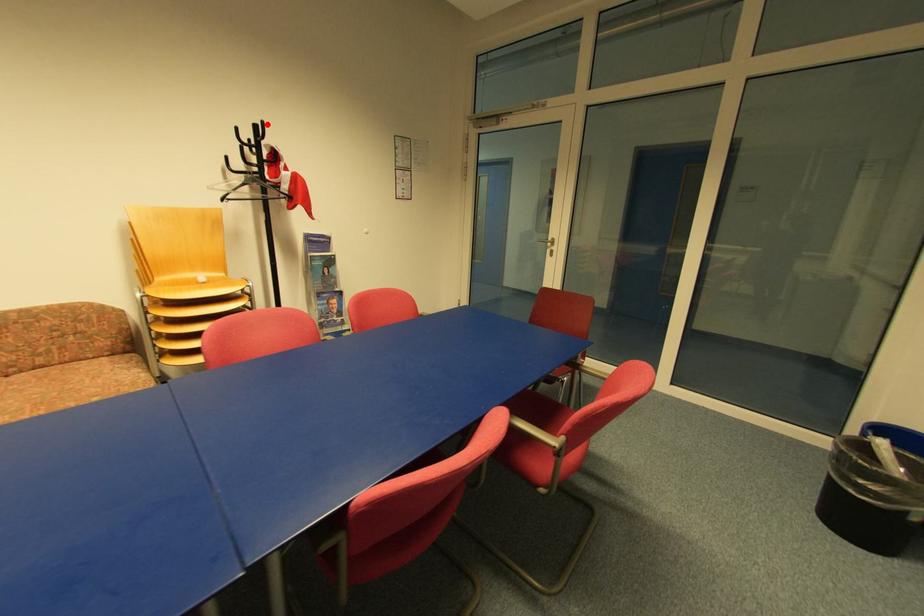
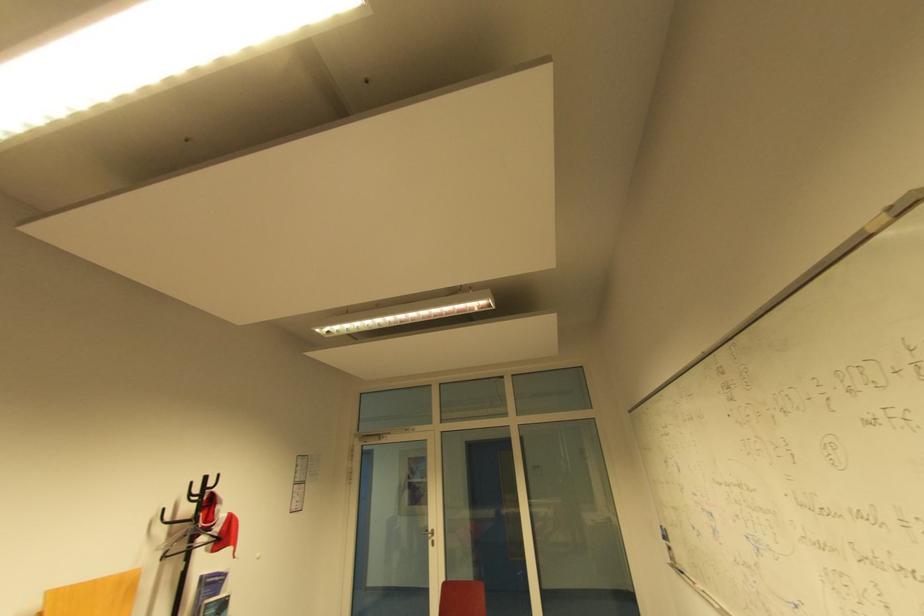
In the second image, find the point that corresponds to the highlighted location in the first image.

(224, 476)